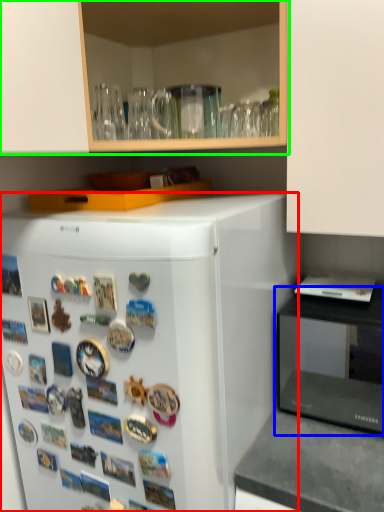
Question: Based on their relative distances, which object is farther from refrigerator (highlighted by a red box)? Choose from appliance (highlighted by a blue box) and cabinetry (highlighted by a green box).

Choices:
 (A) appliance
 (B) cabinetry

Answer: (A)